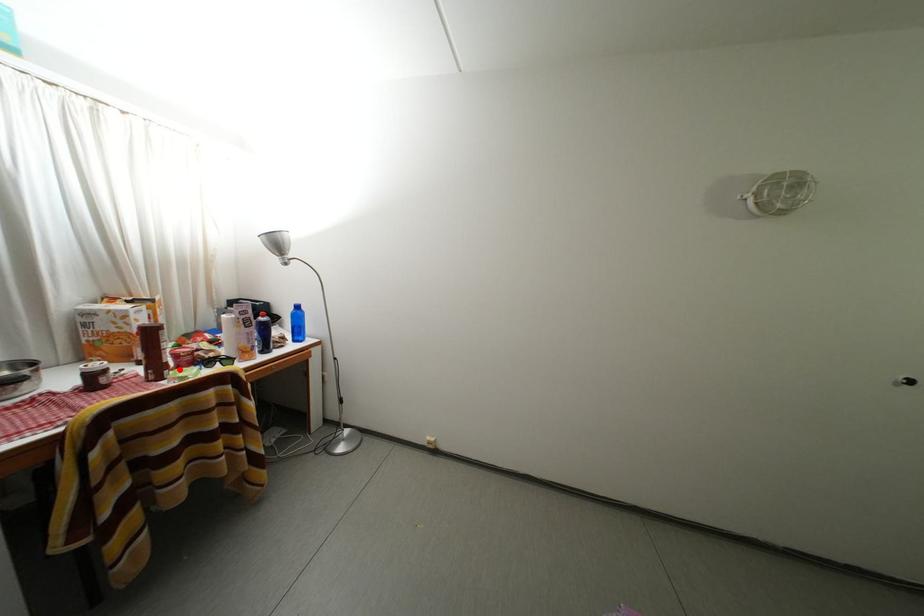
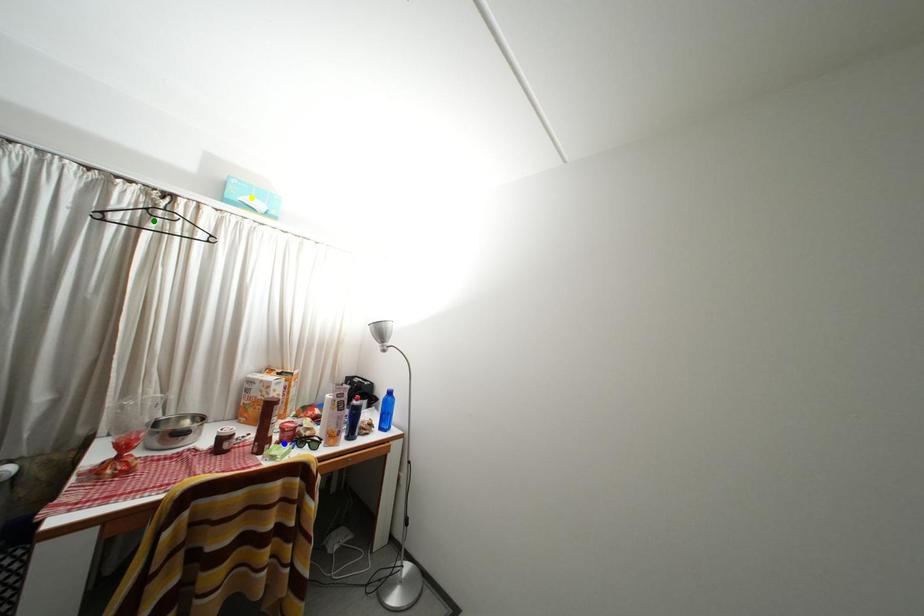
Question: I am providing you with two images of the same scene from different viewpoints. A red point is marked on the first image. You are given multiple points on the second image. Which mark in image 2 goes with the point in image 1?

Choices:
 (A) yellow point
 (B) green point
 (C) blue point

Answer: (C)